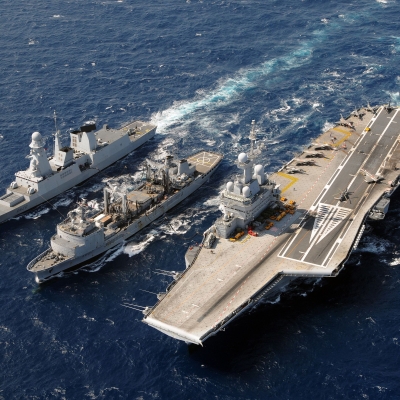
I want to click on landing area, so click(361, 152).